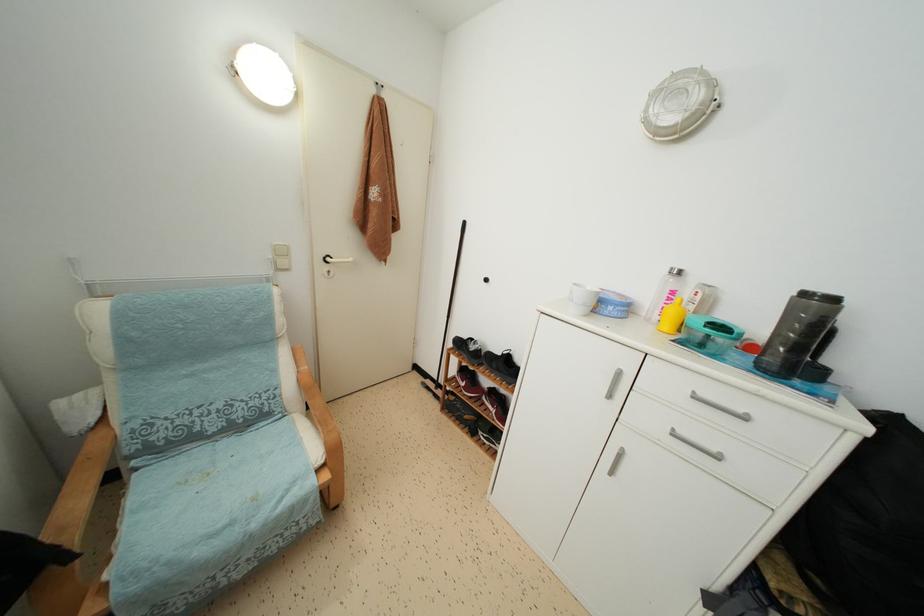
The width and height of the screenshot is (924, 616). Identify the location of red and black shoe. (468, 382).